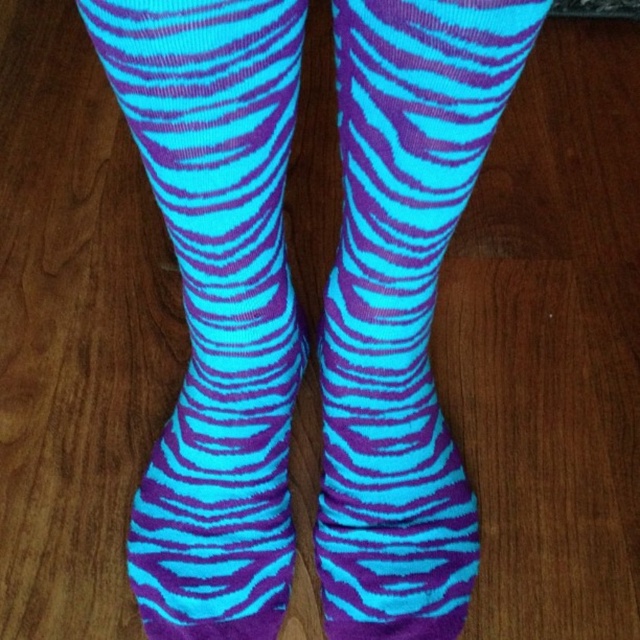
You are standing in a room with the image displayed. You want to touch the point at coordinates point (192, 109). If your arm can reach up to 30 inches, can you comfortably reach that point without moving your feet?

The point (192, 109) is 29.06 inches from the viewer. Since your arm can reach up to 30 inches, you can comfortably reach that point without moving your feet.

You are standing in a room with a wooden floor and see two points marked on the floor. The first point is at point (200, 225) and the second point is at point (433, 602). If you want to walk towards the point that is closer to you, which point should you walk towards?

Point (200, 225) is in front of point (433, 602), so you should walk towards point (200, 225) because it is closer to you.